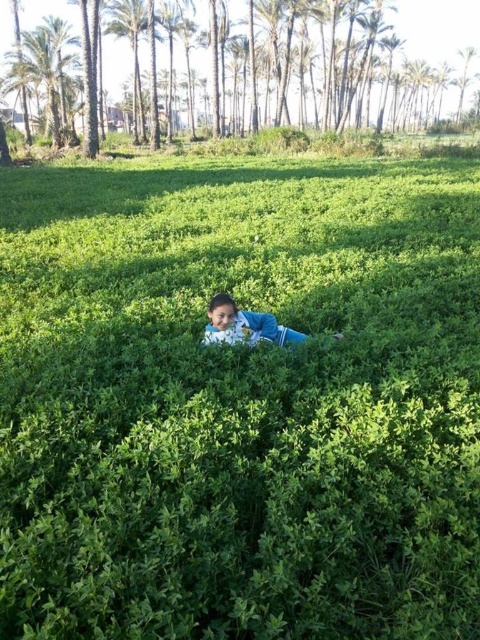
Question: Is blue fabric child at center thinner than green leafy palm tree at upper center?

Choices:
 (A) yes
 (B) no

Answer: (A)

Question: Which object appears closest to the camera in this image?

Choices:
 (A) green leafy palm tree at upper center
 (B) blue fabric child at center

Answer: (B)

Question: Can you confirm if blue fabric child at center is positioned to the right of green leafy palm tree at upper center?

Choices:
 (A) no
 (B) yes

Answer: (B)

Question: Is blue fabric child at center wider than green leafy palm tree at upper center?

Choices:
 (A) no
 (B) yes

Answer: (A)

Question: Which of the following is the farthest from the observer?

Choices:
 (A) blue fabric child at center
 (B) green leafy palm tree at upper center

Answer: (B)